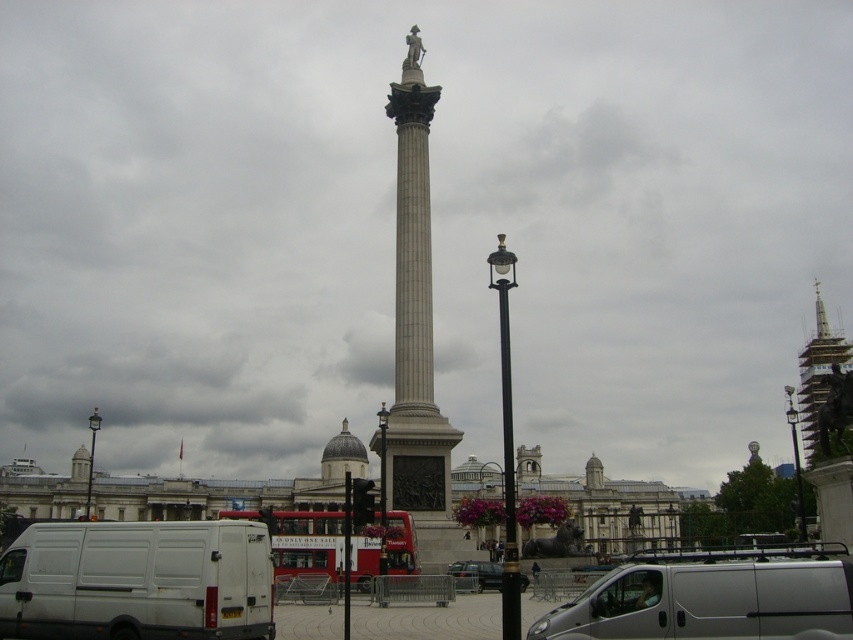
You are a tourist standing in Trafalgar Square, London, looking at the black metal lamp post at center and the black polished lamp post at center. Which lamp post is positioned higher in the image?

The black polished lamp post at center is positioned higher than the black metal lamp post at center in the image.

You are a delivery driver trying to park your van, which is 2.5 meters wide, in Trafalgar Square. You see the silver metallic van at center and the black metal lamp post at center. Can your van fit between them without hitting the lamp post?

The silver metallic van at center might be wider than black metal lamp post at center. Since your van is 2.5 meters wide, it is possible that there is enough space between them, but there is uncertainty due to the width comparison. You should check the exact width of the van and lamp post before attempting to park.

Based on the photo, you are a tourist standing in Trafalgar Square, London, and you see the silver metallic van at center and the black metal lamp post at center. Which object is closer to your right side?

The silver metallic van at center is positioned on the right side of the black metal lamp post at center, so it is closer to your right side.